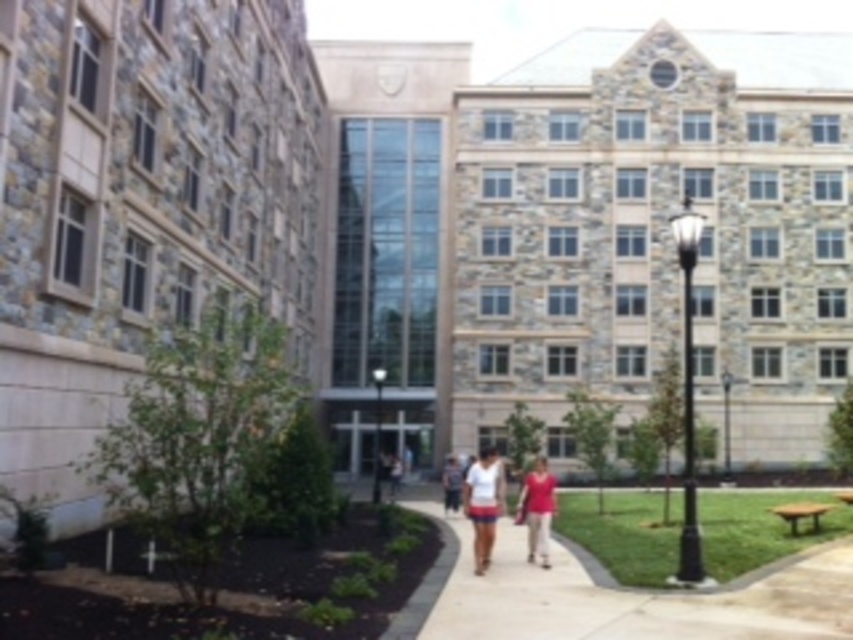
You are a photographer setting up a shoot on the university campus. You have two shirts to choose from, the white cotton shirt at center and the matte pink shirt at center. If you want to wear the shirt that will be more noticeable in the photos due to its size, which one should you choose?

The white cotton shirt at center has a larger size compared to the matte pink shirt at center, so choosing the white cotton shirt at center will make you more noticeable in the photos due to its bigger size.

You are a photographer setting up for an event and need to ensure that the shirts you have are appropriate for the occasion. You have a white cotton shirt at center and a matte pink shirt at center. Which shirt has a wider silhouette when worn?

The white cotton shirt at center has a larger width than the matte pink shirt at center, so it has a wider silhouette when worn.